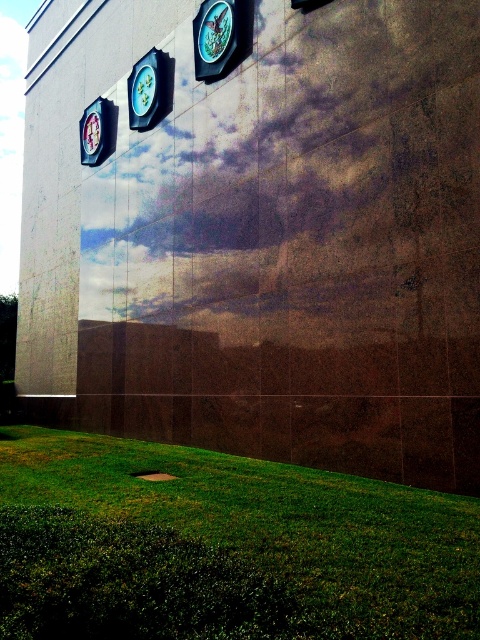
You are standing in front of the wall with the reflective surface and notice two points marked on it. The first point is at coordinate point (26,445) and the second is at point (83,132). Which of these points appears closer to you?

Point (26,445) is closer to the camera than point (83,132), so the first point appears closer to you.

From the picture: You are an interior designer assessing the wall layout. The client wants to know if the metallic silver clock at upper center is placed above the metallic blue clock at left. Can you confirm this based on the wall layout?

The metallic silver clock at upper center is positioned over metallic blue clock at left, so yes, it is placed above it.

You are an interior designer observing the wall with two clocks. The metallic silver clock at upper center and the metallic blue clock at left need to be aligned symmetrically. Based on their current positions, which clock should be moved to the right to achieve symmetry?

The metallic blue clock at left should be moved to the right to align symmetrically with the metallic silver clock at upper center since the metallic silver clock at upper center is already positioned to its right.